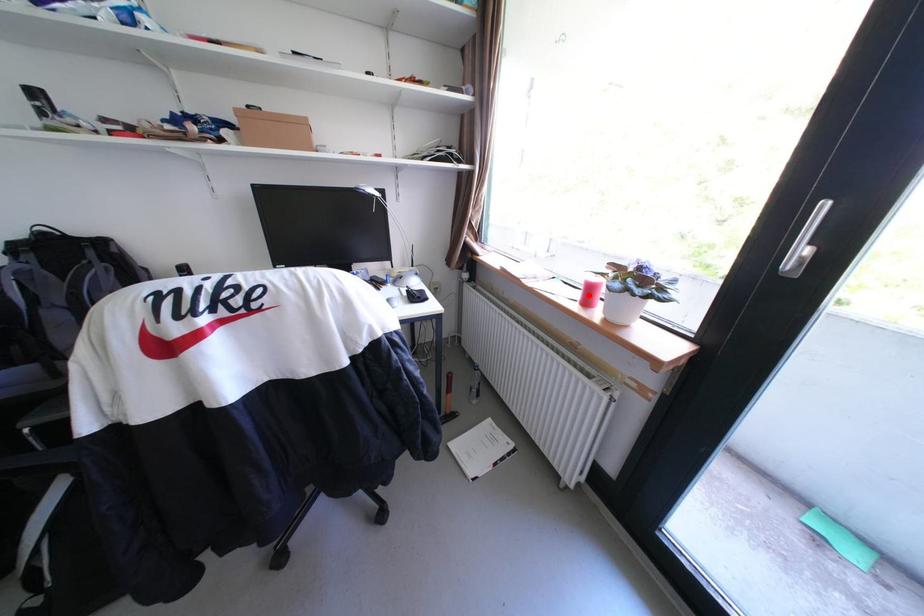
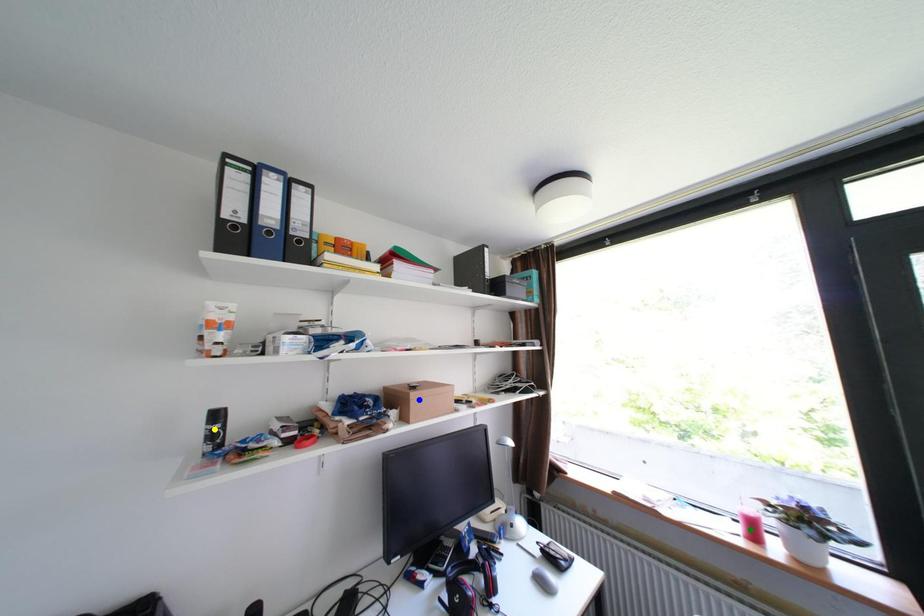
Question: I am providing you with two images of the same scene from different viewpoints. A red point is marked on the first image. You are given multiple points on the second image. In image 2, which mark is for the same physical point as the one in image 1?

Choices:
 (A) blue point
 (B) green point
 (C) yellow point

Answer: (B)